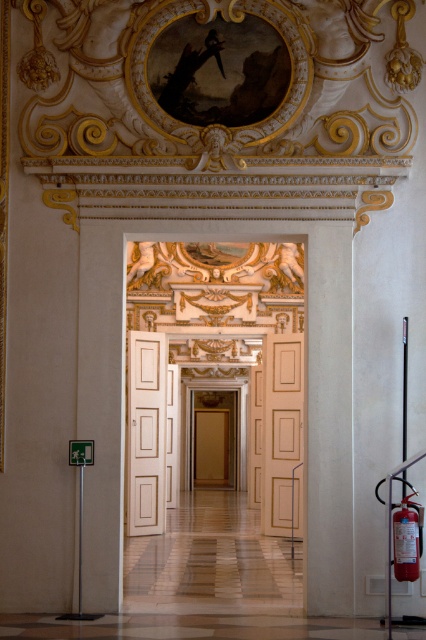
You are a visitor in this grand hallway and want to locate the red matte fire extinguisher at lower right. According to the scene, where would you find it relative to the white glossy door at center?

The red matte fire extinguisher at lower right is behind the white glossy door at center, so you would need to open the door to access it.

In the scene shown: You are standing in the grand corridor and want to take a photo of both the point at coordinates point (245, 310) and the point at coordinates point (417, 492). Which point will appear closer to the camera in the photo?

Point (245, 310) is further to the camera than point (417, 492), so in the photo, point (417, 492) will appear closer to the camera.